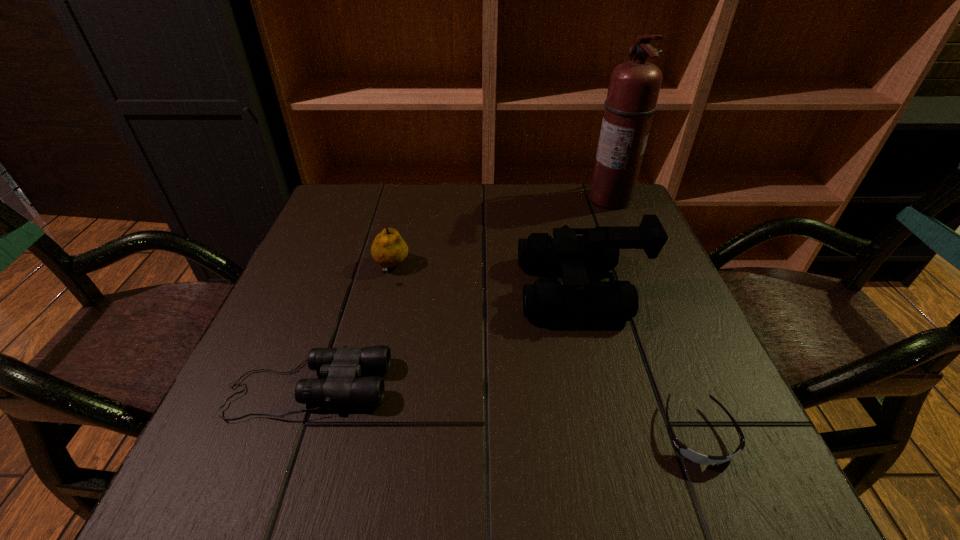
Where is `free spot that satisfies the following two spatial constraints: 1. on the front side of the pear; 2. at the eyepiece of the fourth tallest object`? The height and width of the screenshot is (540, 960). free spot that satisfies the following two spatial constraints: 1. on the front side of the pear; 2. at the eyepiece of the fourth tallest object is located at coordinates (363, 388).